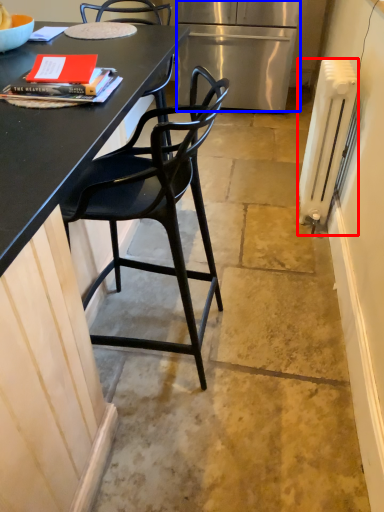
Question: Which object is further to the camera taking this photo, radiator (highlighted by a red box) or refrigerator (highlighted by a blue box)?

Choices:
 (A) radiator
 (B) refrigerator

Answer: (B)